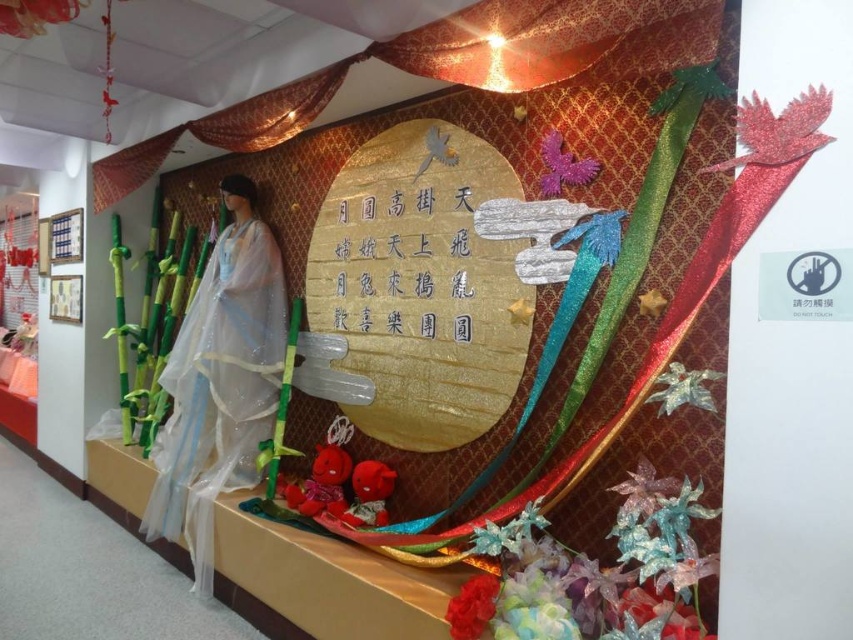
Question: Which is nearer to the translucent white dress at left?

Choices:
 (A) gold shimmering curtain at upper center
 (B) gold paper writing at center

Answer: (B)

Question: Does gold paper lantern at center have a larger size compared to translucent white dress at left?

Choices:
 (A) yes
 (B) no

Answer: (B)

Question: Which is farther from the gold shimmering curtain at upper center?

Choices:
 (A) gold paper writing at center
 (B) gold paper lantern at center

Answer: (B)

Question: Is gold paper lantern at center to the left of gold paper writing at center from the viewer's perspective?

Choices:
 (A) yes
 (B) no

Answer: (B)

Question: Which point is closer to the camera?

Choices:
 (A) (410, 182)
 (B) (392, 248)
 (C) (194, 394)

Answer: (A)

Question: Can you confirm if gold shimmering curtain at upper center is smaller than gold paper writing at center?

Choices:
 (A) no
 (B) yes

Answer: (A)